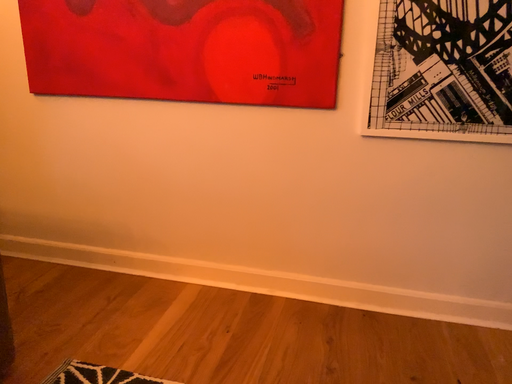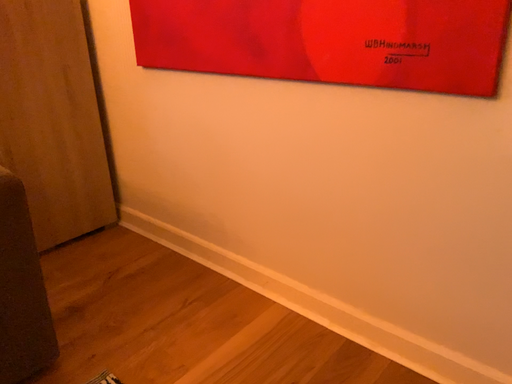
Question: Which way did the camera rotate in the video?

Choices:
 (A) rotated left
 (B) rotated right

Answer: (A)